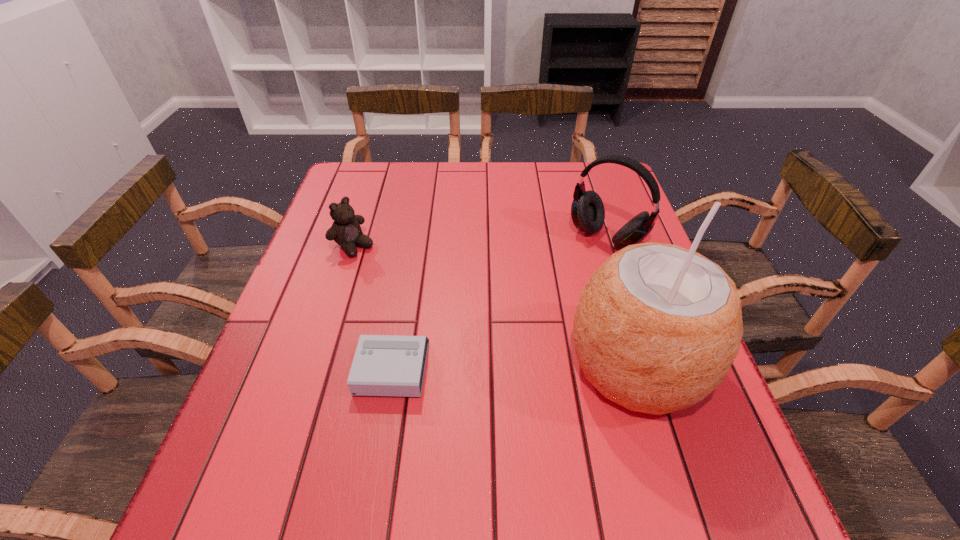
The image size is (960, 540). Find the location of `the shortest object`. the shortest object is located at coordinates (384, 365).

Find the location of a particular element. This screenshot has width=960, height=540. the second object from left to right is located at coordinates (384, 365).

Identify the location of coconut. The image size is (960, 540). (657, 327).

At what (x,y) coordinates should I click in order to perform the action: click on headset. Please return your answer as a coordinate pair (x, y). This screenshot has width=960, height=540. Looking at the image, I should click on (588, 214).

Locate an element on the screen. This screenshot has height=540, width=960. teddy bear is located at coordinates (346, 231).

Find the location of `the third tallest object`. the third tallest object is located at coordinates (346, 231).

The height and width of the screenshot is (540, 960). Identify the location of vacant space located 0.110m on the right of the third object from right to left. (481, 368).

Identify the location of vacant region located 0.270m on the left of the tallest object. The image size is (960, 540). (435, 365).

You are a GUI agent. You are given a task and a screenshot of the screen. Output one action in this format:
    pyautogui.click(x=<x>, y=<y>)
    Task: Click on the vacant area situated 0.400m on the ear cups of the headset
    
    Given the screenshot: What is the action you would take?
    pyautogui.click(x=495, y=355)

Where is `vacant space located on the ear cups of the headset`? This screenshot has width=960, height=540. vacant space located on the ear cups of the headset is located at coordinates (564, 281).